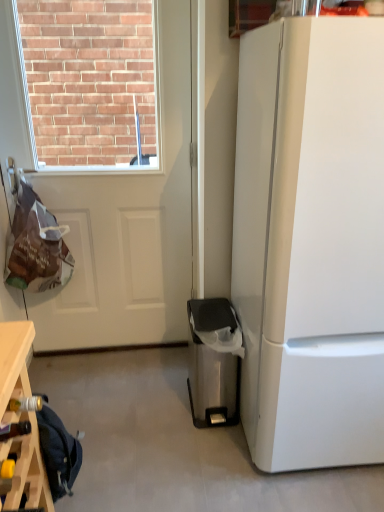
I want to click on free space in front of stainless steel trash can at lower right, so click(205, 454).